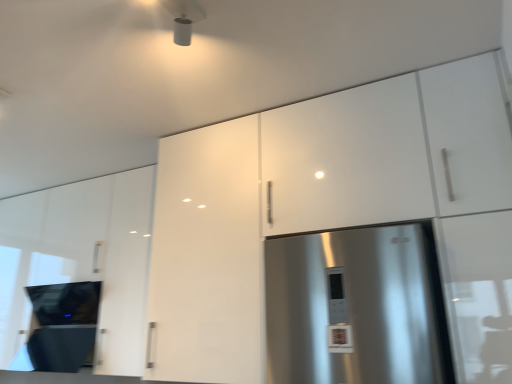
Question: Would you say white glossy cabinet at center, which appears as the second cabinetry when viewed from the left, contains glossy white cabinet at upper left, positioned as the third cabinetry in right-to-left order?

Choices:
 (A) yes
 (B) no

Answer: (B)

Question: From a real-world perspective, is white glossy cabinet at center, which appears as the second cabinetry when viewed from the left, positioned under glossy white cabinet at upper left, positioned as the third cabinetry in right-to-left order, based on gravity?

Choices:
 (A) no
 (B) yes

Answer: (B)

Question: Could you tell me if white glossy cabinet at center, which is the second cabinetry from right to left, is facing glossy white cabinet at upper left, acting as the 1th cabinetry starting from the left?

Choices:
 (A) yes
 (B) no

Answer: (B)

Question: Can you confirm if white glossy cabinet at center, which appears as the second cabinetry when viewed from the left, is thinner than glossy white cabinet at upper left, positioned as the third cabinetry in right-to-left order?

Choices:
 (A) no
 (B) yes

Answer: (A)

Question: Does white glossy cabinet at center, which is the second cabinetry from right to left, touch glossy white cabinet at upper left, acting as the 1th cabinetry starting from the left?

Choices:
 (A) no
 (B) yes

Answer: (A)

Question: Is white glossy cabinet at center, which appears as the second cabinetry when viewed from the left, behind glossy white cabinet at upper left, positioned as the third cabinetry in right-to-left order?

Choices:
 (A) yes
 (B) no

Answer: (B)

Question: Is black glass cooktop at lower left oriented away from glossy white cabinet at upper left, positioned as the third cabinetry in right-to-left order?

Choices:
 (A) no
 (B) yes

Answer: (B)

Question: Does black glass cooktop at lower left have a smaller size compared to glossy white cabinet at upper left, positioned as the third cabinetry in right-to-left order?

Choices:
 (A) yes
 (B) no

Answer: (A)

Question: From a real-world perspective, does black glass cooktop at lower left stand above glossy white cabinet at upper left, acting as the 1th cabinetry starting from the left?

Choices:
 (A) yes
 (B) no

Answer: (B)

Question: Does black glass cooktop at lower left touch glossy white cabinet at upper left, positioned as the third cabinetry in right-to-left order?

Choices:
 (A) yes
 (B) no

Answer: (B)

Question: Is glossy white cabinet at upper left, acting as the 1th cabinetry starting from the left, completely or partially inside black glass cooktop at lower left?

Choices:
 (A) no
 (B) yes

Answer: (A)

Question: From the image's perspective, is black glass cooktop at lower left on top of glossy white cabinet at upper left, positioned as the third cabinetry in right-to-left order?

Choices:
 (A) yes
 (B) no

Answer: (B)

Question: From a real-world perspective, is white glossy cabinet at upper right, positioned as the 1th cabinetry in right-to-left order, positioned over white glossy cabinet at center, which is the second cabinetry from right to left, based on gravity?

Choices:
 (A) yes
 (B) no

Answer: (A)